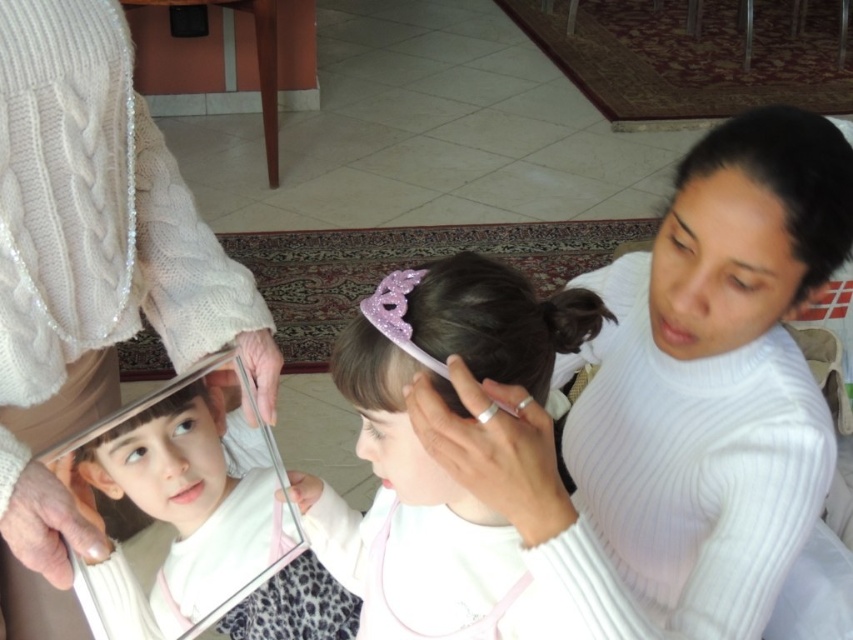
Question: Which object appears farthest from the camera in this image?

Choices:
 (A) purple glitter crown at center
 (B) black shiny hair at upper right
 (C) silver metallic mirror at center
 (D) white ribbed sweater at upper right

Answer: (C)

Question: Does silver metallic mirror at center have a smaller size compared to purple glitter crown at center?

Choices:
 (A) yes
 (B) no

Answer: (B)

Question: Is white ribbed sweater at upper right below silver metallic mirror at center?

Choices:
 (A) yes
 (B) no

Answer: (B)

Question: Is white cable-knit sweater at upper left below black shiny hair at upper right?

Choices:
 (A) no
 (B) yes

Answer: (B)

Question: Among these points, which one is farthest from the camera?

Choices:
 (A) (440, 310)
 (B) (769, 579)
 (C) (758, 141)

Answer: (B)

Question: Which object is closer to the camera taking this photo?

Choices:
 (A) black shiny hair at upper right
 (B) silver metallic mirror at center
 (C) pink glitter crown at center

Answer: (C)